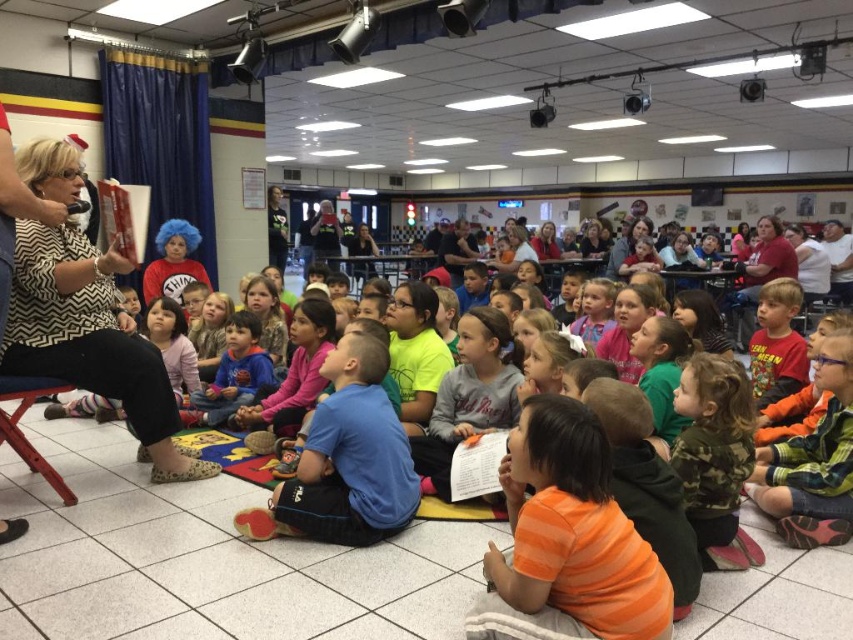
Which of these two, patterned fabric shirt at left or blue fleece jacket at center, stands taller?

patterned fabric shirt at left is taller.

How far apart are patterned fabric shirt at left and blue fleece jacket at center?

The distance of patterned fabric shirt at left from blue fleece jacket at center is 1.16 meters.

Identify the location of patterned fabric shirt at left. (90, 339).

Consider the image. Who is more distant from viewer, (532,486) or (193,422)?

The point (193,422) is behind.

Which is above, orange cotton shirt at center or blue fleece jacket at center?

blue fleece jacket at center is higher up.

Is point (664, 632) in front of point (229, 326)?

Yes, point (664, 632) is closer to viewer.

Locate an element on the screen. The height and width of the screenshot is (640, 853). orange cotton shirt at center is located at coordinates (567, 540).

Is orange cotton shirt at center bigger than patterned fabric shirt at left?

No, orange cotton shirt at center is not bigger than patterned fabric shirt at left.

Is point (578, 476) behind point (166, 467)?

No.

The width and height of the screenshot is (853, 640). Describe the element at coordinates (567, 540) in the screenshot. I see `orange cotton shirt at center` at that location.

At what (x,y) coordinates should I click in order to perform the action: click on orange cotton shirt at center. Please return your answer as a coordinate pair (x, y). Image resolution: width=853 pixels, height=640 pixels. Looking at the image, I should click on (567, 540).